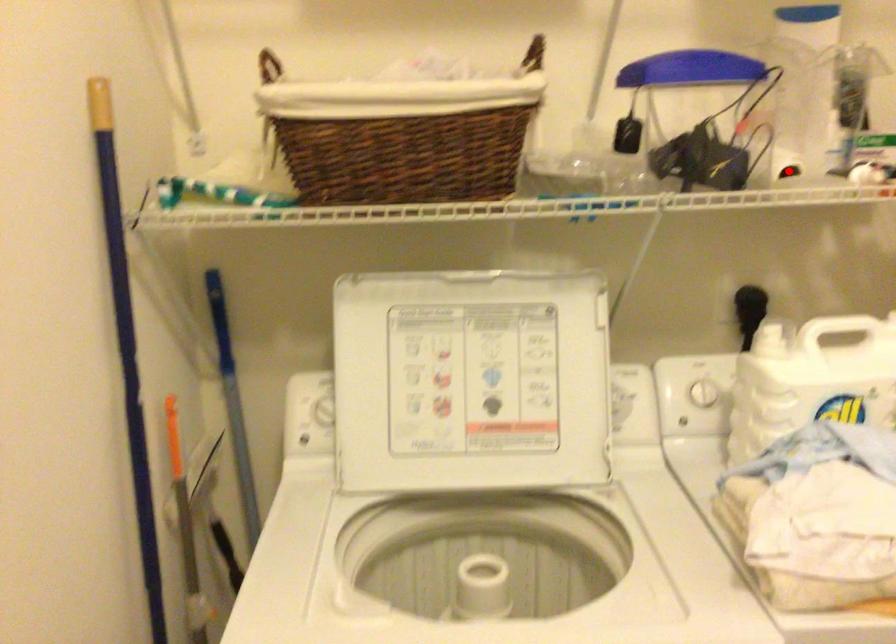
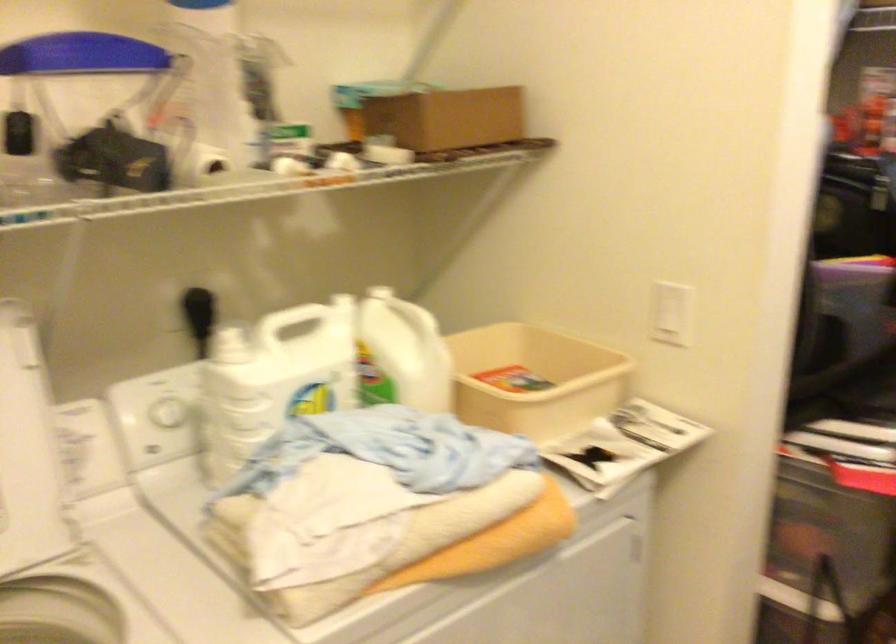
In the second image, find the point that corresponds to the highlighted location in the first image.

(211, 162)